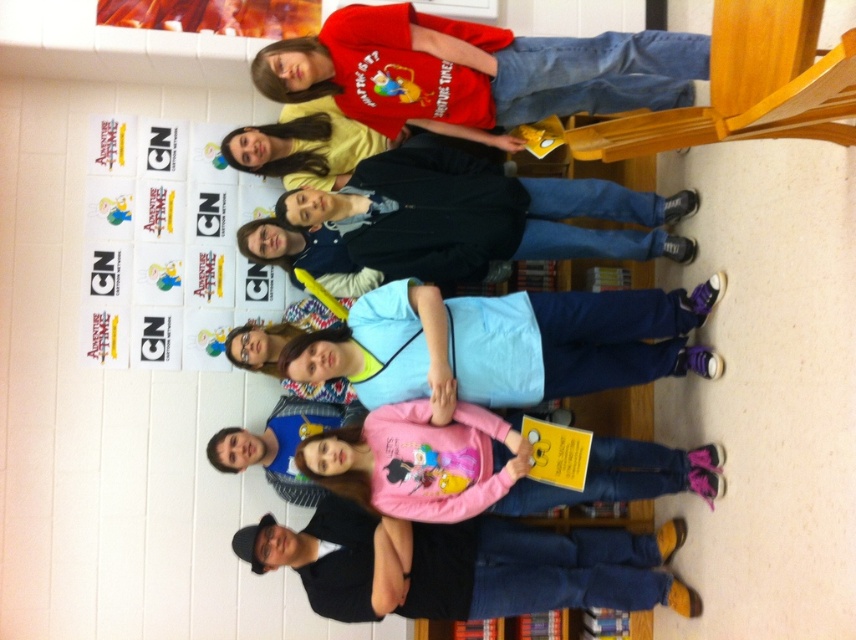
Can you confirm if matte red t-shirt at upper center is positioned to the left of black matte shirt at lower center?

No, matte red t-shirt at upper center is not to the left of black matte shirt at lower center.

Is point (661, 96) less distant than point (339, 541)?

Yes, it is.

Who is more distant from viewer, (597, 64) or (343, 600)?

The point (343, 600) is behind.

Locate an element on the screen. Image resolution: width=856 pixels, height=640 pixels. matte red t-shirt at upper center is located at coordinates (474, 70).

Based on the photo, can you confirm if black matte shirt at lower center is shorter than matte black jacket at center?

Indeed, black matte shirt at lower center has a lesser height compared to matte black jacket at center.

Is point (520, 554) in front of point (465, 156)?

Yes, it is in front of point (465, 156).

At what (x,y) coordinates should I click in order to perform the action: click on black matte shirt at lower center. Please return your answer as a coordinate pair (x, y). Looking at the image, I should click on (465, 564).

Can you confirm if matte red t-shirt at upper center is thinner than matte black jacket at center?

Indeed, matte red t-shirt at upper center has a lesser width compared to matte black jacket at center.

Is point (296, 70) in front of point (604, 205)?

Yes.

Is point (491, 28) positioned behind point (387, 209)?

No, (491, 28) is closer to viewer.

Image resolution: width=856 pixels, height=640 pixels. Identify the location of matte red t-shirt at upper center. (474, 70).